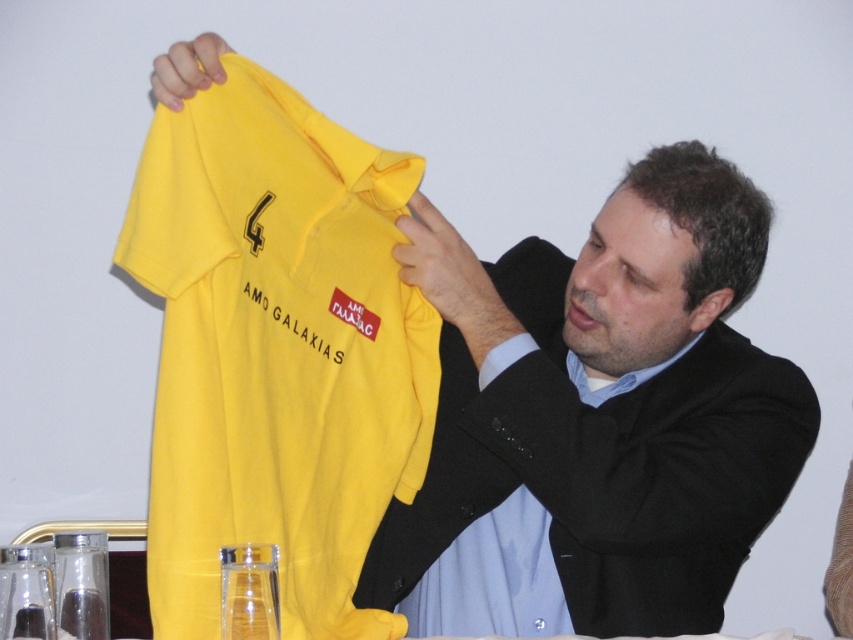
Question: Is matte yellow shirt at center closer to camera compared to matte yellow shirt at upper center?

Choices:
 (A) yes
 (B) no

Answer: (A)

Question: Among these points, which one is nearest to the camera?

Choices:
 (A) (476, 563)
 (B) (624, 388)

Answer: (A)

Question: From the image, what is the correct spatial relationship of matte yellow shirt at center in relation to matte yellow shirt at upper center?

Choices:
 (A) right
 (B) left

Answer: (A)

Question: Which object appears farthest from the camera in this image?

Choices:
 (A) matte yellow shirt at center
 (B) matte yellow shirt at upper center

Answer: (B)

Question: Where is matte yellow shirt at center located in relation to matte yellow shirt at upper center in the image?

Choices:
 (A) left
 (B) right

Answer: (B)